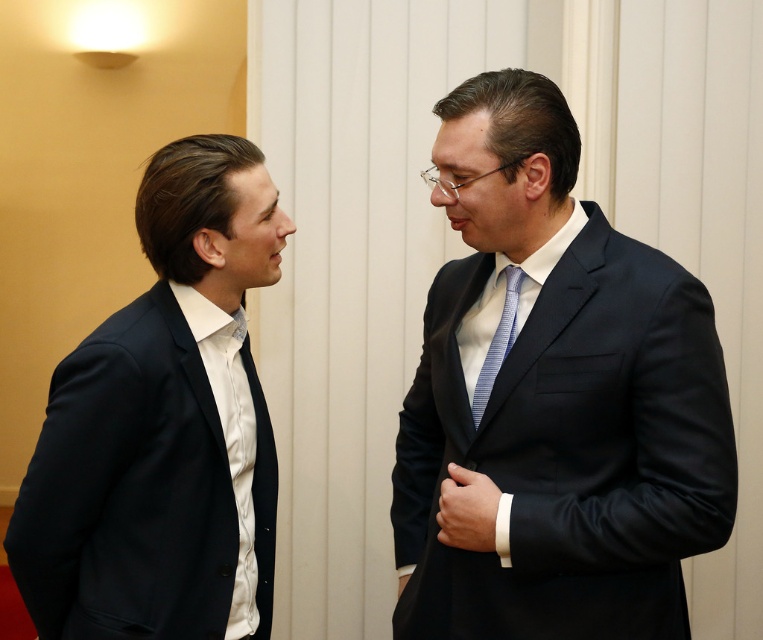
Is matte black suit at right closer to the viewer compared to blue striped tie at center?

That is True.

Which is below, matte black suit at right or blue striped tie at center?

matte black suit at right is below.

You are a GUI agent. You are given a task and a screenshot of the screen. Output one action in this format:
    pyautogui.click(x=<x>, y=<y>)
    Task: Click on the matte black suit at right
    
    Given the screenshot: What is the action you would take?
    pyautogui.click(x=552, y=401)

Who is shorter, matte black suit at right or matte black suit at left?

Standing shorter between the two is matte black suit at left.

Who is more forward, (501, 550) or (171, 483)?

Point (501, 550) is in front.

Is point (559, 205) in front of point (37, 472)?

No, (559, 205) is further to viewer.

At what (x,y) coordinates should I click in order to perform the action: click on matte black suit at right. Please return your answer as a coordinate pair (x, y). The image size is (763, 640). Looking at the image, I should click on (552, 401).

Is point (79, 547) positioned before point (520, 288)?

That is True.

Can you confirm if matte black suit at left is positioned above blue striped tie at center?

No.

At what (x,y) coordinates should I click in order to perform the action: click on matte black suit at left. Please return your answer as a coordinate pair (x, y). The height and width of the screenshot is (640, 763). Looking at the image, I should click on (163, 426).